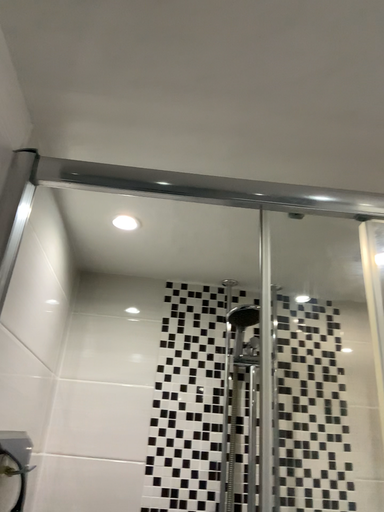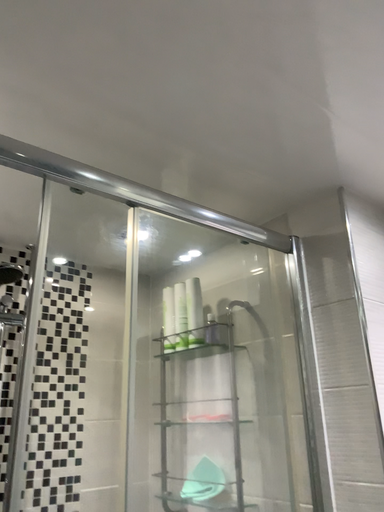
Question: Which way did the camera rotate in the video?

Choices:
 (A) rotated downward
 (B) rotated upward

Answer: (A)